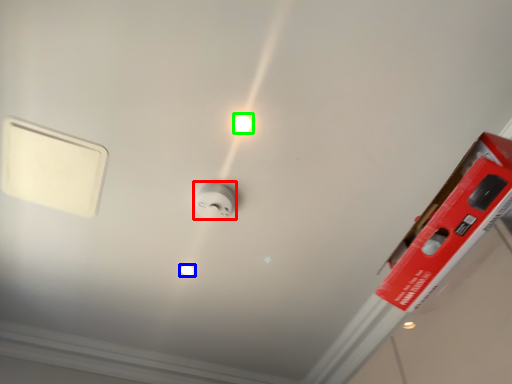
Question: Which object is positioned farthest from power plugs and sockets (highlighted by a red box)? Select from light bulb (highlighted by a blue box) and light bulb (highlighted by a green box).

Choices:
 (A) light bulb
 (B) light bulb

Answer: (A)